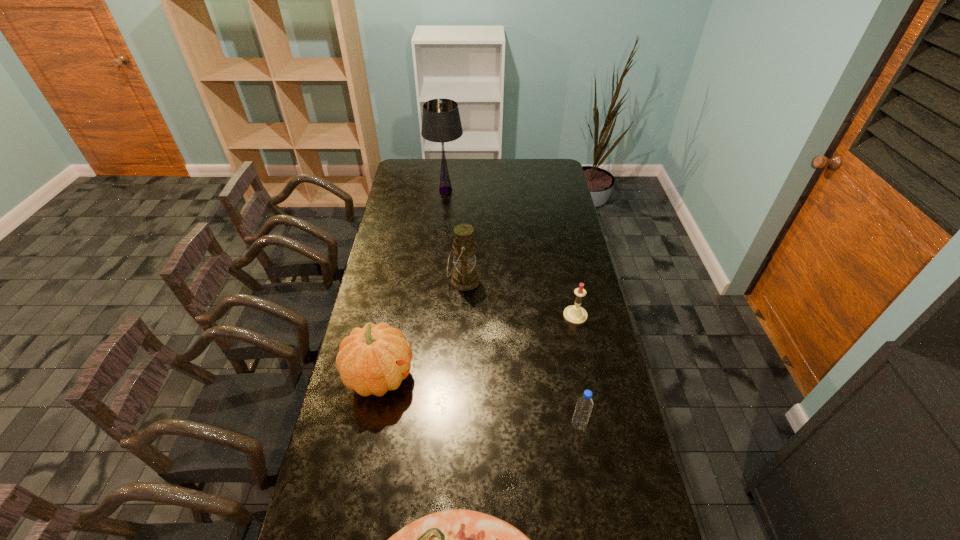
This screenshot has width=960, height=540. I want to click on unoccupied position between the third farthest object and the fifth farthest object, so tap(577, 370).

At what (x,y) coordinates should I click in order to perform the action: click on blank region between the water bottle and the fourth farthest object. Please return your answer as a coordinate pair (x, y). The width and height of the screenshot is (960, 540). Looking at the image, I should click on (479, 401).

This screenshot has height=540, width=960. In order to click on vacant space that is in between the second nearest object and the candle in this screenshot , I will do `click(577, 370)`.

Locate an element on the screen. vacant space in between the second nearest object and the oil lamp is located at coordinates (521, 353).

Locate an element on the screen. The image size is (960, 540). free spot between the pumpkin and the candle is located at coordinates (477, 346).

You are a GUI agent. You are given a task and a screenshot of the screen. Output one action in this format:
    pyautogui.click(x=<x>, y=<y>)
    Task: Click on the second closest object to the oil lamp
    This screenshot has width=960, height=540.
    Given the screenshot: What is the action you would take?
    pyautogui.click(x=575, y=314)

Image resolution: width=960 pixels, height=540 pixels. What are the coordinates of `object that stands as the second closest to the lampshade` in the screenshot? It's located at (575, 314).

Where is `free region that satisfies the following two spatial constraints: 1. on the front-facing side of the water bottle; 2. on the left side of the tallest object`? free region that satisfies the following two spatial constraints: 1. on the front-facing side of the water bottle; 2. on the left side of the tallest object is located at coordinates (421, 425).

This screenshot has height=540, width=960. I want to click on free point that satisfies the following two spatial constraints: 1. on the front side of the fifth nearest object; 2. on the left side of the water bottle, so click(458, 425).

This screenshot has width=960, height=540. I want to click on vacant space that satisfies the following two spatial constraints: 1. on the front-facing side of the tallest object; 2. on the right side of the oil lamp, so click(437, 281).